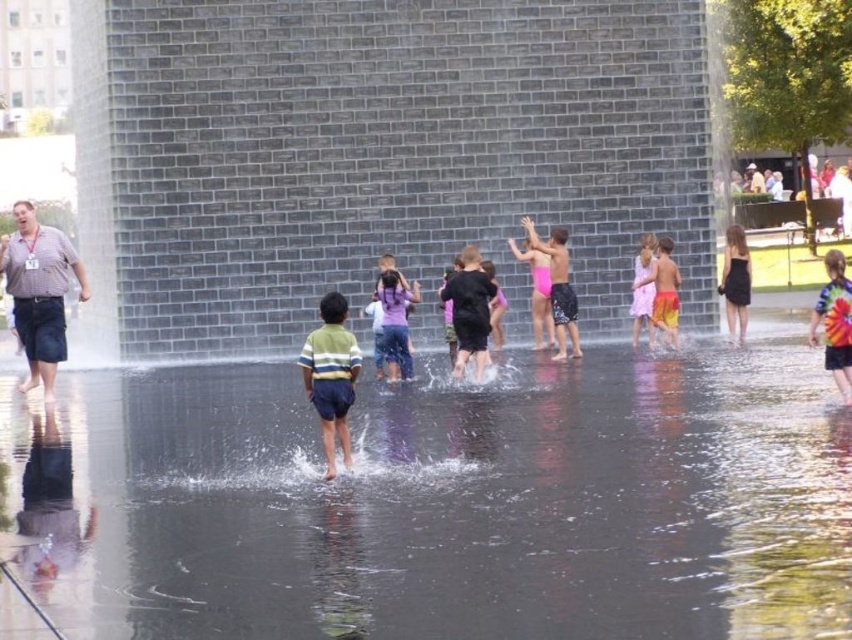
You are standing at the water fountain and see two points marked in the image. Which point, point (671, 513) or point (830, 252), is closer to you?

Point (671, 513) is closer to you than point (830, 252).

You are a photographer trying to capture a candid shot of the striped shirt shorts at center left and the striped cotton shirt at center. Since you want to ensure both are in focus, you need to know which one is wider. Can you tell me which object is wider?

The striped shirt shorts at center left is wider than the striped cotton shirt at center.

You are a photographer standing at the edge of the fountain. You want to take a photo that includes both the striped shirt shorts at center left and the striped cotton shirt at center. Which one of the two objects will appear bigger in your photo?

The striped shirt shorts at center left will appear bigger in the photo because it is larger in size than the striped cotton shirt at center.